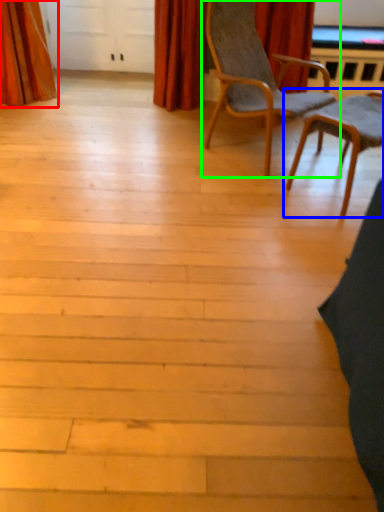
Question: Which is nearer to the curtain (highlighted by a red box)? chair (highlighted by a blue box) or chair (highlighted by a green box).

Choices:
 (A) chair
 (B) chair

Answer: (B)